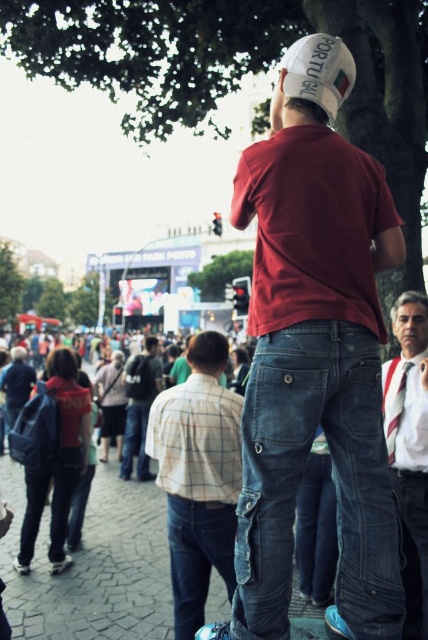
Is denim jeans at center taller than striped tie at center?

Yes.

Locate an element on the screen. This screenshot has width=428, height=640. denim jeans at center is located at coordinates (315, 353).

Is point (262, 474) farther from viewer compared to point (424, 529)?

That is False.

I want to click on denim jeans at center, so coord(315,353).

Who is lower down, white fabric baseball cap at upper center or striped cotton shirt at lower right?

striped cotton shirt at lower right is below.

How far apart are white fabric baseball cap at upper center and striped cotton shirt at lower right?

white fabric baseball cap at upper center and striped cotton shirt at lower right are 22.04 meters apart from each other.

The height and width of the screenshot is (640, 428). Find the location of `white fabric baseball cap at upper center`. white fabric baseball cap at upper center is located at coordinates (318, 72).

Does checkered shirt at center appear over striped tie at center?

Actually, checkered shirt at center is below striped tie at center.

Does checkered shirt at center have a lesser width compared to striped tie at center?

Incorrect, checkered shirt at center's width is not less than striped tie at center's.

What do you see at coordinates (198, 476) in the screenshot?
I see `checkered shirt at center` at bounding box center [198, 476].

Find the location of a particular element. The image size is (428, 640). checkered shirt at center is located at coordinates (198, 476).